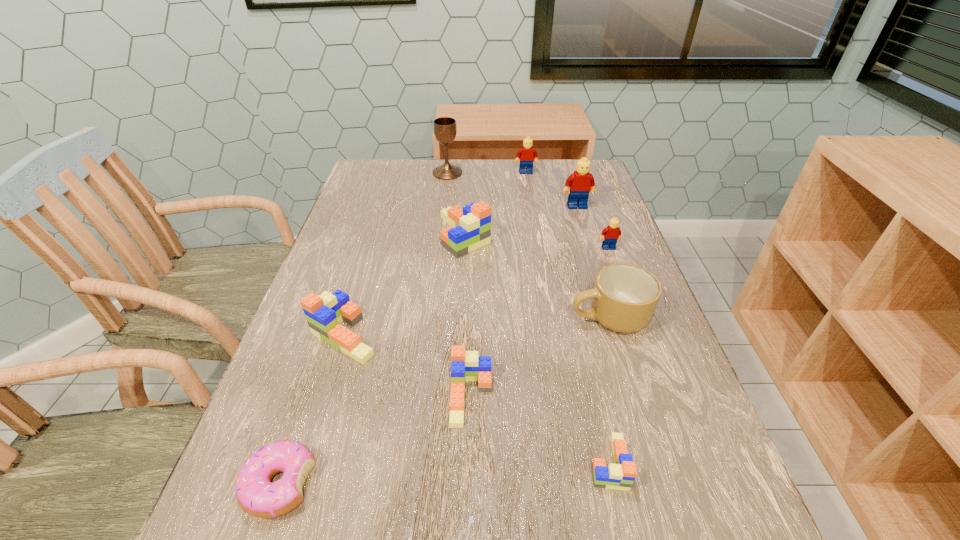
Where is `the third shortest object`? This screenshot has height=540, width=960. the third shortest object is located at coordinates (465, 365).

Image resolution: width=960 pixels, height=540 pixels. Find the location of `the sixth tallest Lego`. the sixth tallest Lego is located at coordinates (465, 365).

Image resolution: width=960 pixels, height=540 pixels. What are the coordinates of `the nearest Lego` in the screenshot? It's located at (620, 476).

Where is `the shortest Lego`? This screenshot has width=960, height=540. the shortest Lego is located at coordinates (620, 476).

Locate an element on the screen. Image resolution: width=960 pixels, height=540 pixels. pink doughnut is located at coordinates (259, 497).

The height and width of the screenshot is (540, 960). I want to click on vacant point located on the right of the chalice, so click(x=499, y=173).

This screenshot has width=960, height=540. Find the location of `free space located on the front-facing side of the second tallest object`. free space located on the front-facing side of the second tallest object is located at coordinates (597, 272).

Identify the location of vacant space situated 0.210m on the front-facing side of the second biggest yellow Lego. (532, 210).

Locate an element on the screen. The image size is (960, 540). free space located on the right of the farthest orange Lego is located at coordinates (554, 234).

The height and width of the screenshot is (540, 960). What are the coordinates of `free space located on the side with the handle of the mug` in the screenshot? It's located at click(x=457, y=318).